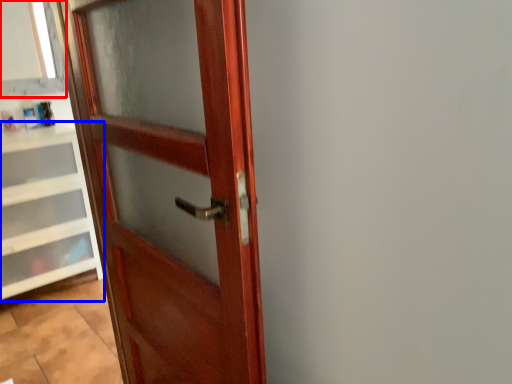
Question: Which object is further to the camera taking this photo, window frame (highlighted by a red box) or cabinetry (highlighted by a blue box)?

Choices:
 (A) window frame
 (B) cabinetry

Answer: (A)